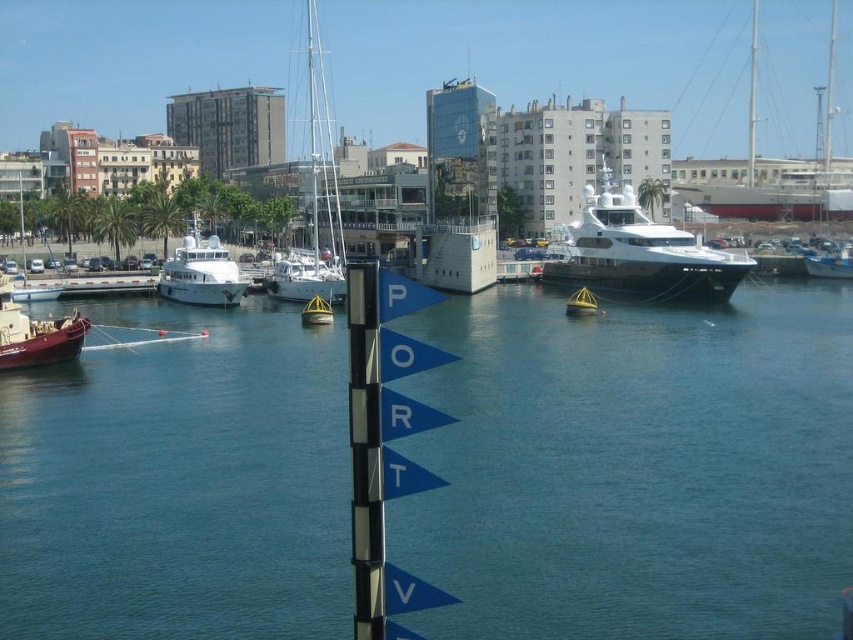
Question: Which point is closer to the camera?

Choices:
 (A) (311, 486)
 (B) (335, 184)

Answer: (A)

Question: Is white glossy sailboat at center smaller than white glossy yacht at center?

Choices:
 (A) yes
 (B) no

Answer: (B)

Question: Observing the image, what is the correct spatial positioning of white glossy sailboat at center in reference to white glossy boat at right?

Choices:
 (A) left
 (B) right

Answer: (A)

Question: Is blue water at center below white glossy yacht at center?

Choices:
 (A) yes
 (B) no

Answer: (A)

Question: Which point is farther from the camera taking this photo?

Choices:
 (A) (328, 272)
 (B) (198, 260)
 (C) (590, 240)
 (D) (706, 435)

Answer: (C)

Question: Which object appears closest to the camera in this image?

Choices:
 (A) white glossy boat at right
 (B) shiny white yacht at center
 (C) white glossy sailboat at center
 (D) white glossy yacht at center

Answer: (B)